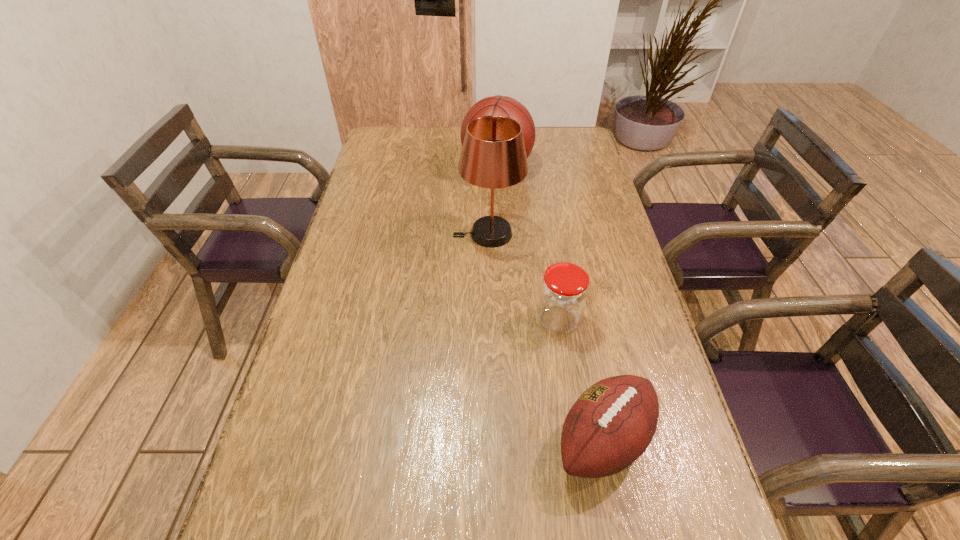
Identify which object is the closest to the lampshade. Please provide its 2D coordinates. Your answer should be formatted as a tuple, i.e. [(x, y)], where the tuple contains the x and y coordinates of a point satisfying the conditions above.

[(498, 105)]

The width and height of the screenshot is (960, 540). Find the location of `blank area in the image that satisfies the following two spatial constraints: 1. on the front-facing side of the lampshade; 2. on the left side of the second nearest object`. blank area in the image that satisfies the following two spatial constraints: 1. on the front-facing side of the lampshade; 2. on the left side of the second nearest object is located at coordinates (490, 320).

At what (x,y) coordinates should I click in order to perform the action: click on free location that satisfies the following two spatial constraints: 1. on the front side of the third farthest object; 2. on the right side of the football (American). Please return your answer as a coordinate pair (x, y). This screenshot has height=540, width=960. Looking at the image, I should click on (577, 441).

Where is `free point that satisfies the following two spatial constraints: 1. on the front side of the nearest object; 2. on the left side of the farthest object`? This screenshot has height=540, width=960. free point that satisfies the following two spatial constraints: 1. on the front side of the nearest object; 2. on the left side of the farthest object is located at coordinates (510, 441).

Image resolution: width=960 pixels, height=540 pixels. I want to click on free location that satisfies the following two spatial constraints: 1. on the front-facing side of the tallest object; 2. on the right side of the nearest object, so click(x=492, y=441).

The image size is (960, 540). In order to click on free space that satisfies the following two spatial constraints: 1. on the front side of the nearest object; 2. on the right side of the jar in this screenshot , I will do `click(577, 441)`.